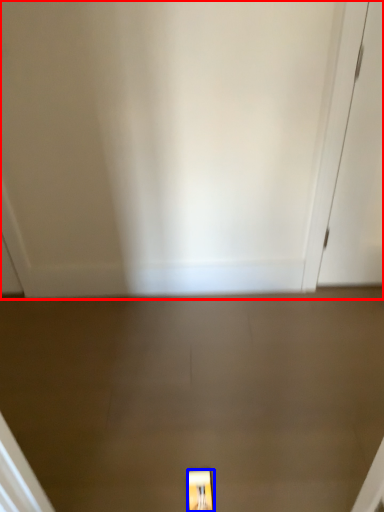
Question: Among these objects, which one is farthest to the camera, door (highlighted by a red box) or light fixture (highlighted by a blue box)?

Choices:
 (A) door
 (B) light fixture

Answer: (B)